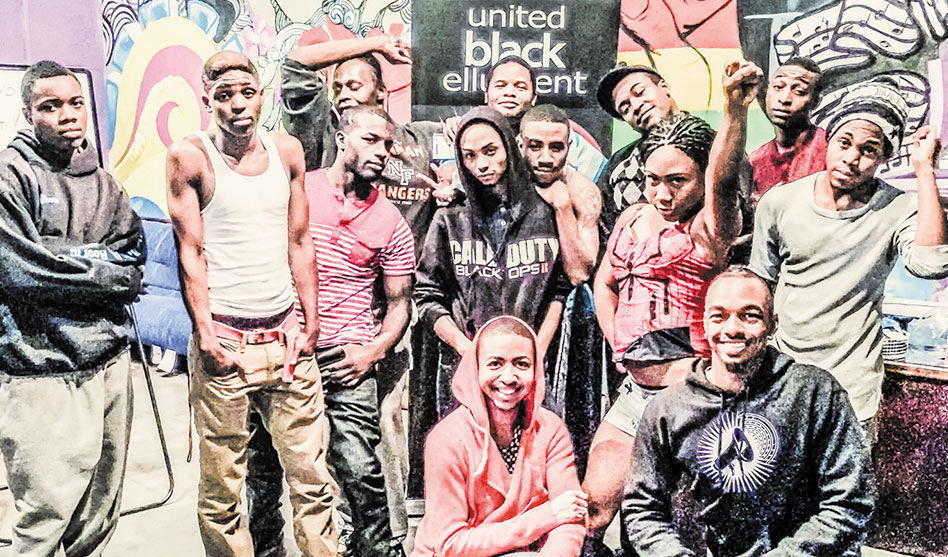
Identify the location of mural. (155, 66).